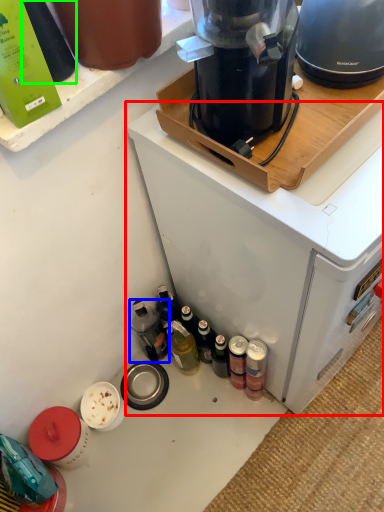
Question: Which is farther away from home appliance (highlighted by a red box)? bottle (highlighted by a blue box) or bottle (highlighted by a green box)?

Choices:
 (A) bottle
 (B) bottle

Answer: (B)